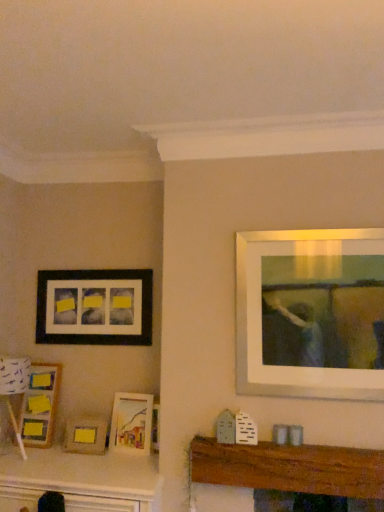
Question: Do you think white paper lampshade at lower left is within wooden picture frame at lower left, which ranks as the 3th picture frame in bottom-to-top order, or outside of it?

Choices:
 (A) outside
 (B) inside

Answer: (A)

Question: Relative to wooden picture frame at lower left, acting as the 2th picture frame starting from the top, is white paper lampshade at lower left in front or behind?

Choices:
 (A) front
 (B) behind

Answer: (A)

Question: Estimate the real-world distances between objects in this image. Which object is closer to the matte wooden picture frame at center, acting as the 3th picture frame starting from the top?

Choices:
 (A) matte yellow picture frame at lower left, the 4th picture frame positioned from the top
 (B) white paper lampshade at lower left
 (C) wooden picture frame at lower left, acting as the 2th picture frame starting from the top
 (D) matte black picture frame at left, placed as the fourth picture frame when sorted from bottom to top
 (E) wooden mantel at center

Answer: (A)

Question: Which is nearer to the matte wooden picture frame at center, the 2th picture frame when ordered from bottom to top?

Choices:
 (A) wooden mantel at center
 (B) matte yellow picture frame at lower left, the 4th picture frame positioned from the top
 (C) matte black picture frame at left, which appears as the first picture frame when viewed from the top
 (D) white paper lampshade at lower left
 (E) wooden picture frame at lower left, acting as the 2th picture frame starting from the top

Answer: (B)